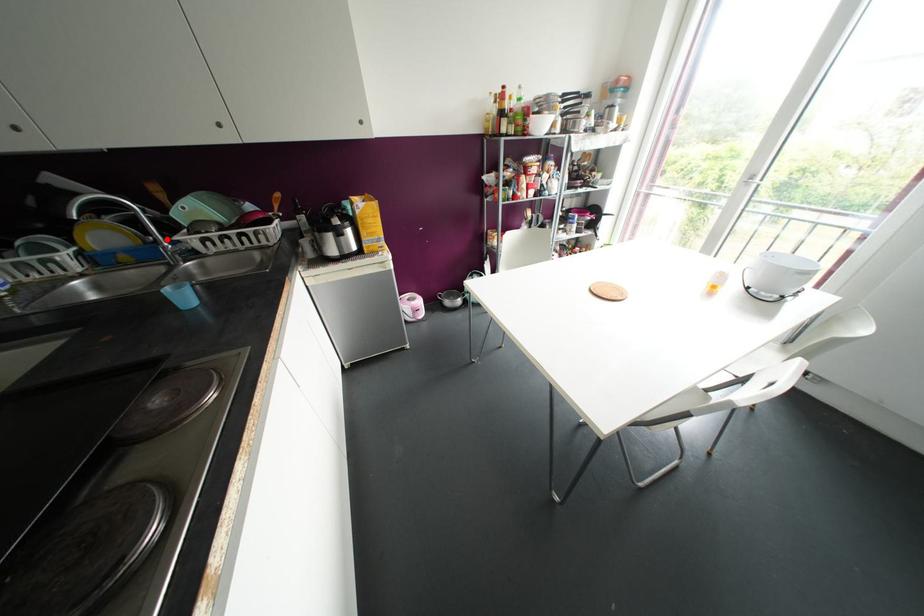
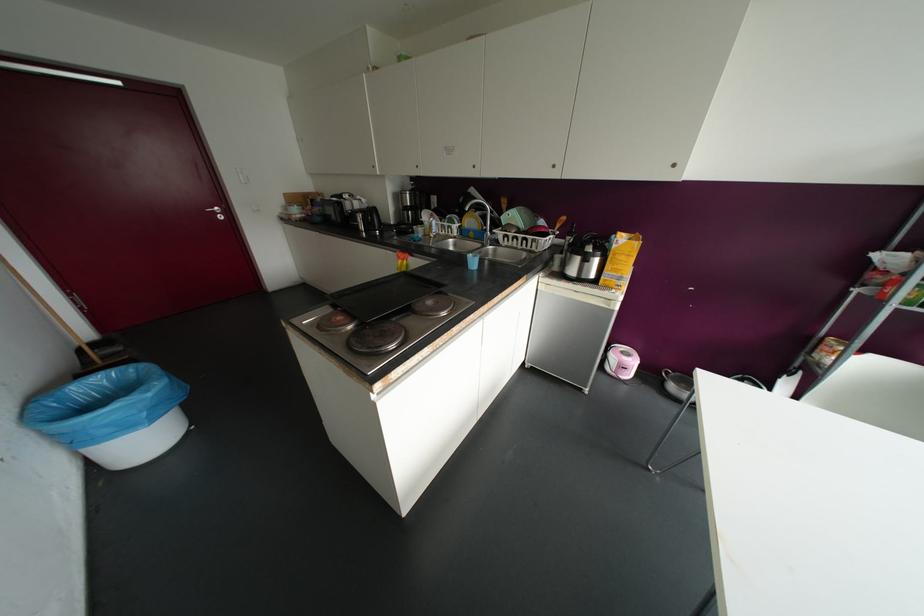
Where in the second image is the point corresponding to the highlighted location from the first image?

(490, 230)